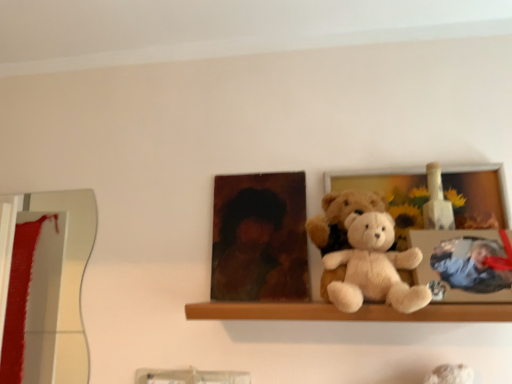
Question: Is wooden shelf at center taller than white plush teddy bear at center, which ranks as the 1th teddy bear in front-to-back order?

Choices:
 (A) no
 (B) yes

Answer: (A)

Question: Is wooden shelf at center facing away from white plush teddy bear at center, which ranks as the 1th teddy bear in front-to-back order?

Choices:
 (A) no
 (B) yes

Answer: (A)

Question: Considering the relative sizes of wooden shelf at center and white plush teddy bear at center, arranged as the second teddy bear when viewed from the back, in the image provided, is wooden shelf at center shorter than white plush teddy bear at center, arranged as the second teddy bear when viewed from the back,?

Choices:
 (A) yes
 (B) no

Answer: (A)

Question: From the image's perspective, is wooden shelf at center under white plush teddy bear at center, which ranks as the 1th teddy bear in front-to-back order?

Choices:
 (A) yes
 (B) no

Answer: (A)

Question: Is white plush teddy bear at center, arranged as the second teddy bear when viewed from the back, surrounded by wooden shelf at center?

Choices:
 (A) yes
 (B) no

Answer: (B)

Question: Considering the positions of fluffy beige teddy bear at center, marked as the 2th teddy bear in a front-to-back arrangement, and matte brown portrait at center in the image, is fluffy beige teddy bear at center, marked as the 2th teddy bear in a front-to-back arrangement, wider or thinner than matte brown portrait at center?

Choices:
 (A) thin
 (B) wide

Answer: (B)

Question: From the image's perspective, relative to matte brown portrait at center, is fluffy beige teddy bear at center, arranged as the first teddy bear when viewed from the back, above or below?

Choices:
 (A) below
 (B) above

Answer: (A)

Question: Based on their sizes in the image, would you say fluffy beige teddy bear at center, marked as the 2th teddy bear in a front-to-back arrangement, is bigger or smaller than matte brown portrait at center?

Choices:
 (A) small
 (B) big

Answer: (B)

Question: Is point (371, 205) positioned closer to the camera than point (287, 291)?

Choices:
 (A) farther
 (B) closer

Answer: (B)

Question: Visually, is white plush teddy bear at center, which ranks as the 1th teddy bear in front-to-back order, positioned to the left or to the right of wooden shelf at center?

Choices:
 (A) left
 (B) right

Answer: (B)

Question: From the image's perspective, is white plush teddy bear at center, which ranks as the 1th teddy bear in front-to-back order, positioned above or below wooden shelf at center?

Choices:
 (A) below
 (B) above

Answer: (B)

Question: Looking at the image, does white plush teddy bear at center, which ranks as the 1th teddy bear in front-to-back order, seem bigger or smaller compared to wooden shelf at center?

Choices:
 (A) big
 (B) small

Answer: (B)

Question: Considering their positions, is white plush teddy bear at center, arranged as the second teddy bear when viewed from the back, located in front of or behind wooden shelf at center?

Choices:
 (A) behind
 (B) front

Answer: (B)

Question: In terms of size, does matte brown portrait at center appear bigger or smaller than wooden photo frame at center?

Choices:
 (A) big
 (B) small

Answer: (B)

Question: Is point (217, 246) closer or farther from the camera than point (402, 240)?

Choices:
 (A) farther
 (B) closer

Answer: (A)